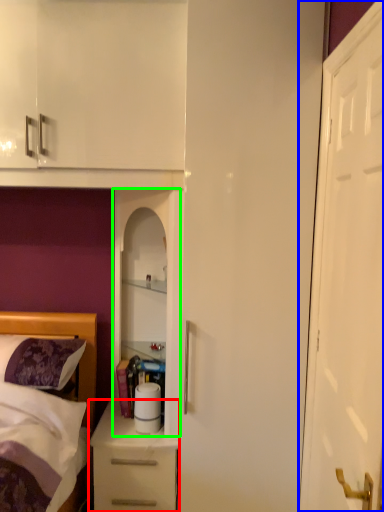
Question: Estimate the real-world distances between objects in this image. Which object is farther from chest of drawers (highlighted by a red box), door (highlighted by a blue box) or cabinetry (highlighted by a green box)?

Choices:
 (A) door
 (B) cabinetry

Answer: (A)